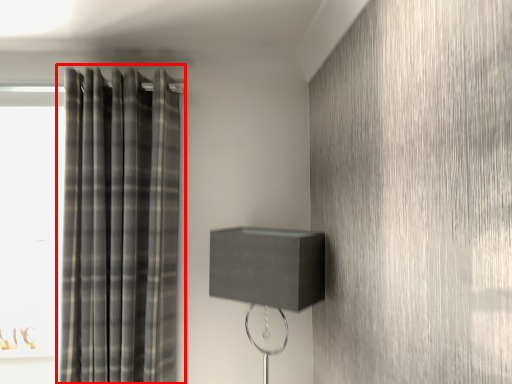
Question: From the image's perspective, considering the relative positions of curtain (annotated by the red box) and table lamp in the image provided, where is curtain (annotated by the red box) located with respect to the staircase?

Choices:
 (A) above
 (B) below

Answer: (A)